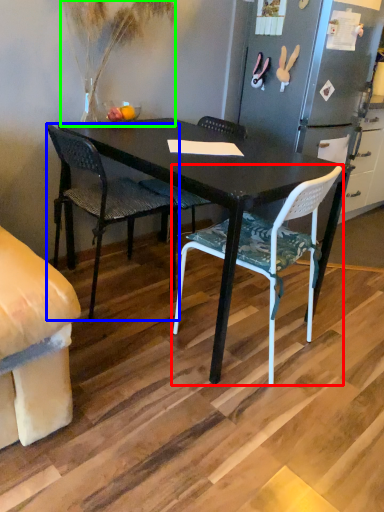
Question: Which object is the farthest from chair (highlighted by a red box)? Choose among these: chair (highlighted by a blue box) or houseplant (highlighted by a green box).

Choices:
 (A) chair
 (B) houseplant

Answer: (B)